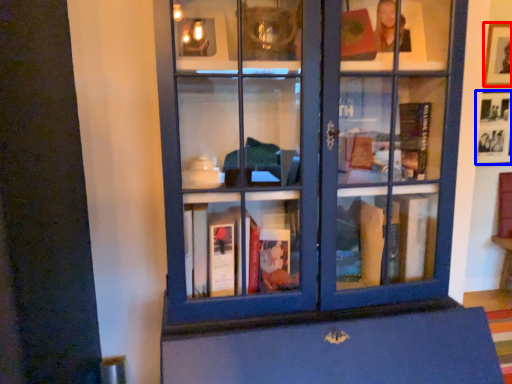
Question: Which object appears closest to the camera in this image, picture frame (highlighted by a red box) or picture frame (highlighted by a blue box)?

Choices:
 (A) picture frame
 (B) picture frame

Answer: (A)